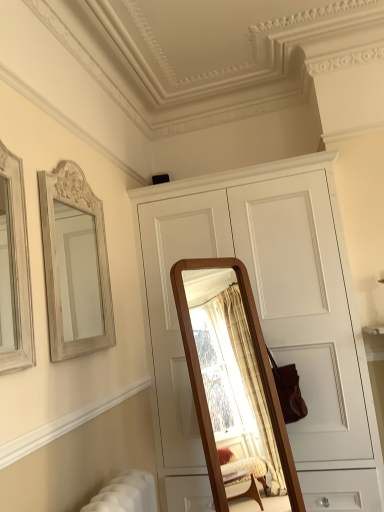
Question: Is white carved wood mirror at upper left in front of wooden frame mirror at left?

Choices:
 (A) no
 (B) yes

Answer: (A)

Question: Is white carved wood mirror at upper left facing towards wooden frame mirror at left?

Choices:
 (A) yes
 (B) no

Answer: (B)

Question: Can you confirm if white carved wood mirror at upper left is shorter than wooden frame mirror at left?

Choices:
 (A) yes
 (B) no

Answer: (A)

Question: From the image's perspective, is white carved wood mirror at upper left over wooden frame mirror at left?

Choices:
 (A) no
 (B) yes

Answer: (A)

Question: Does white carved wood mirror at upper left have a greater width compared to wooden frame mirror at left?

Choices:
 (A) no
 (B) yes

Answer: (A)

Question: Is white carved wood mirror at upper left turned away from wooden frame mirror at left?

Choices:
 (A) yes
 (B) no

Answer: (B)

Question: Is wooden frame mirror at left closer to camera compared to white wood cabinet at center?

Choices:
 (A) yes
 (B) no

Answer: (A)

Question: Is wooden frame mirror at left wider than white wood cabinet at center?

Choices:
 (A) yes
 (B) no

Answer: (B)

Question: Considering the relative sizes of wooden frame mirror at left and white wood cabinet at center in the image provided, is wooden frame mirror at left shorter than white wood cabinet at center?

Choices:
 (A) yes
 (B) no

Answer: (A)

Question: Is wooden frame mirror at left outside white wood cabinet at center?

Choices:
 (A) yes
 (B) no

Answer: (A)

Question: Considering the relative sizes of wooden frame mirror at left and white wood cabinet at center in the image provided, is wooden frame mirror at left thinner than white wood cabinet at center?

Choices:
 (A) yes
 (B) no

Answer: (A)

Question: Are wooden frame mirror at left and white wood cabinet at center making contact?

Choices:
 (A) no
 (B) yes

Answer: (A)

Question: Is white wood cabinet at center smaller than wooden frame mirror at left?

Choices:
 (A) no
 (B) yes

Answer: (A)